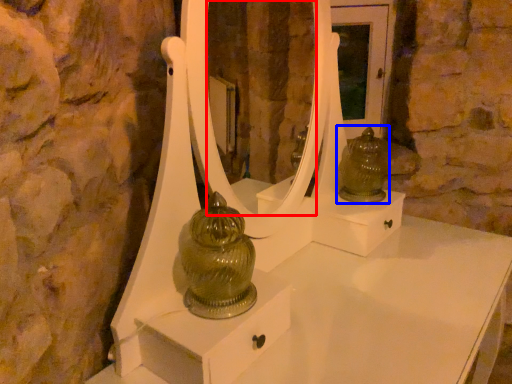
Question: Among these objects, which one is nearest to the camera, mirror (highlighted by a red box) or figurine (highlighted by a blue box)?

Choices:
 (A) mirror
 (B) figurine

Answer: (B)